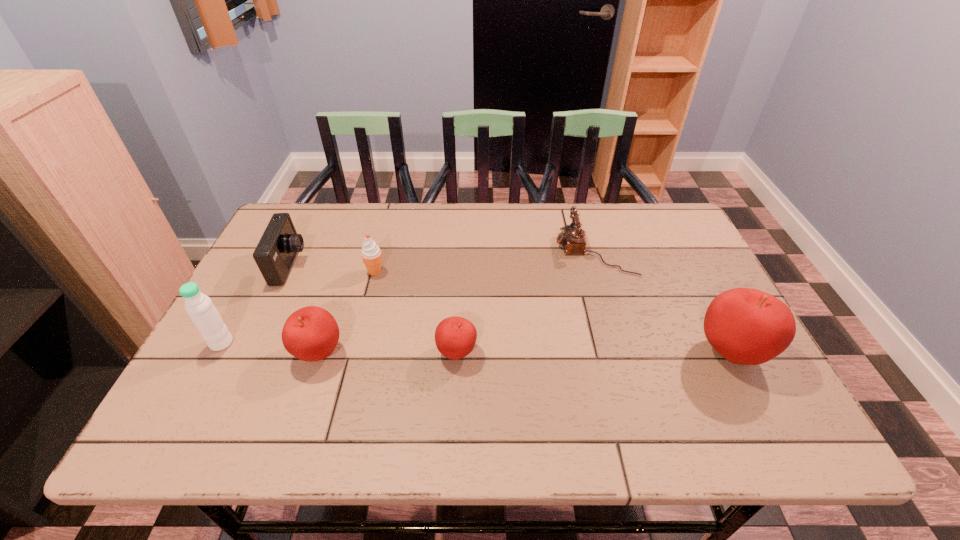
At what (x,y) coordinates should I click in order to perform the action: click on camera that is at the left edge. Please return your answer as a coordinate pair (x, y). The image size is (960, 540). Looking at the image, I should click on (275, 253).

Locate an element on the screen. Image resolution: width=960 pixels, height=540 pixels. water bottle that is at the left edge is located at coordinates (204, 315).

Identify the location of object at the right edge. (746, 326).

At what (x,y) coordinates should I click in order to perform the action: click on object that is at the far left corner. Please return your answer as a coordinate pair (x, y). The height and width of the screenshot is (540, 960). Looking at the image, I should click on [x=275, y=253].

This screenshot has height=540, width=960. Find the location of `object present at the near right corner`. object present at the near right corner is located at coordinates (746, 326).

At what (x,y) coordinates should I click in order to perform the action: click on blank space at the far edge. Please return your answer as a coordinate pair (x, y). The image size is (960, 540). Looking at the image, I should click on (385, 208).

The image size is (960, 540). I want to click on vacant space at the near edge of the desktop, so click(x=369, y=394).

Image resolution: width=960 pixels, height=540 pixels. Find the location of `free space at the left edge of the desktop`. free space at the left edge of the desktop is located at coordinates (233, 309).

This screenshot has height=540, width=960. What are the coordinates of `free spot at the right edge of the desktop` in the screenshot? It's located at pos(671,291).

What are the coordinates of `free space at the near left corner of the desktop` in the screenshot? It's located at (229, 393).